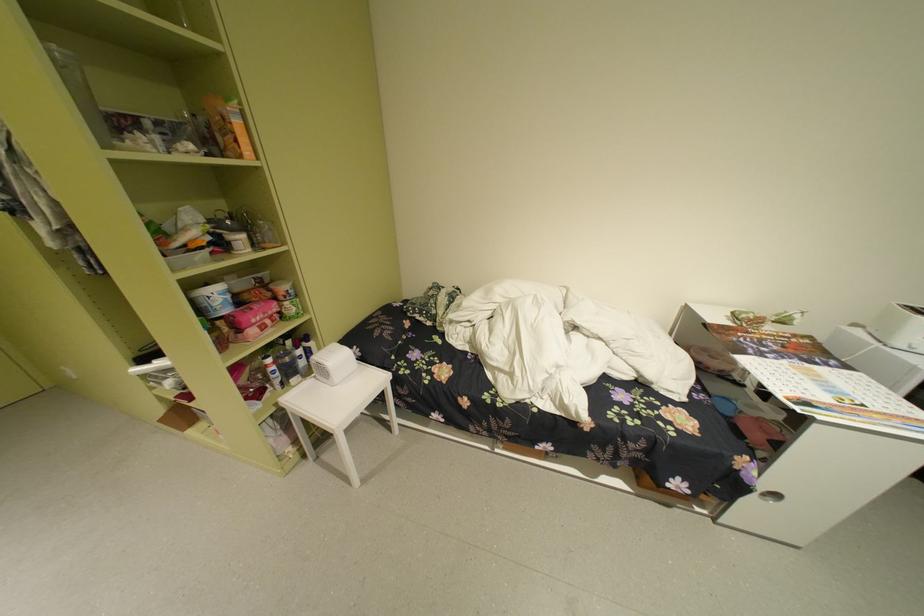
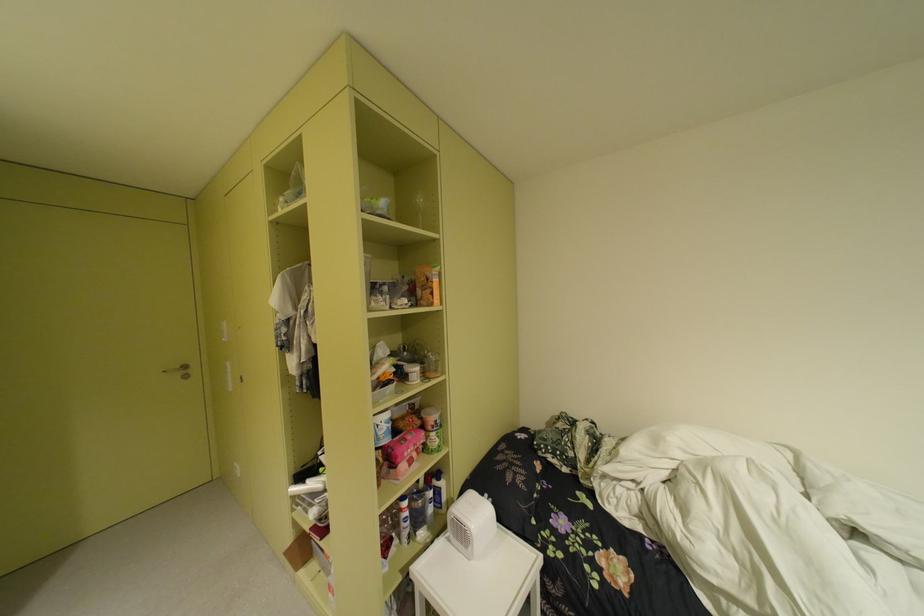
The images are taken continuously from a first-person perspective. In which direction is your viewpoint rotating?

The camera's rotation is toward left-up.